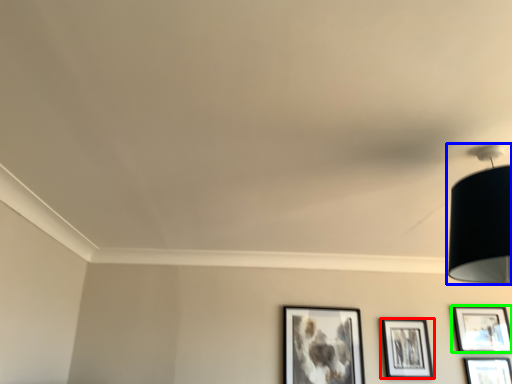
Question: Estimate the real-world distances between objects in this image. Which object is closer to picture frame (highlighted by a red box), lamp (highlighted by a blue box) or picture frame (highlighted by a green box)?

Choices:
 (A) lamp
 (B) picture frame

Answer: (B)